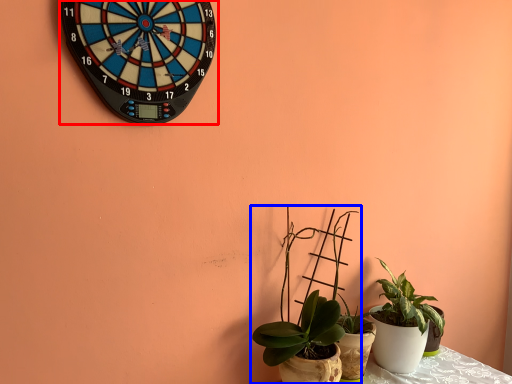
Question: Which object appears closest to the camera in this image, wall clock (highlighted by a red box) or houseplant (highlighted by a blue box)?

Choices:
 (A) wall clock
 (B) houseplant

Answer: (A)